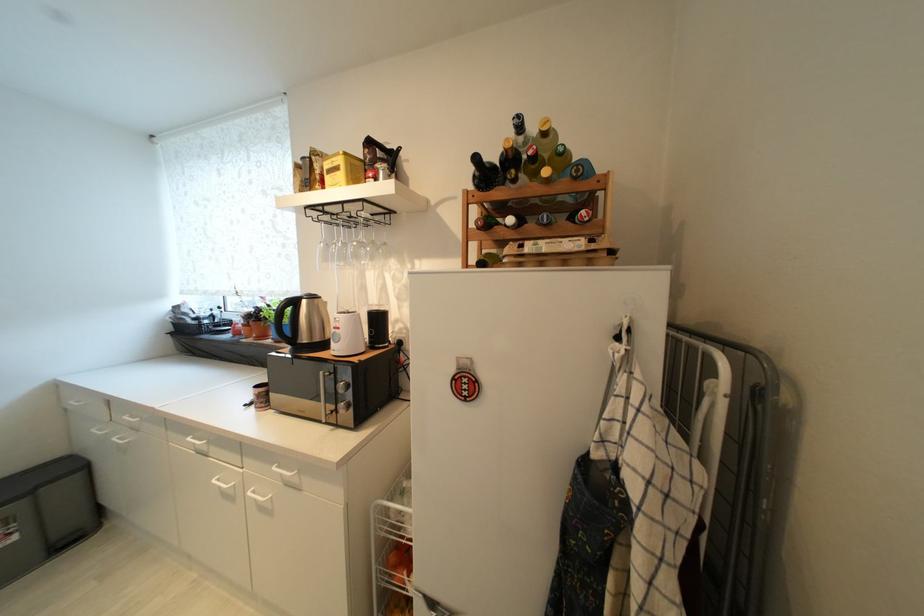
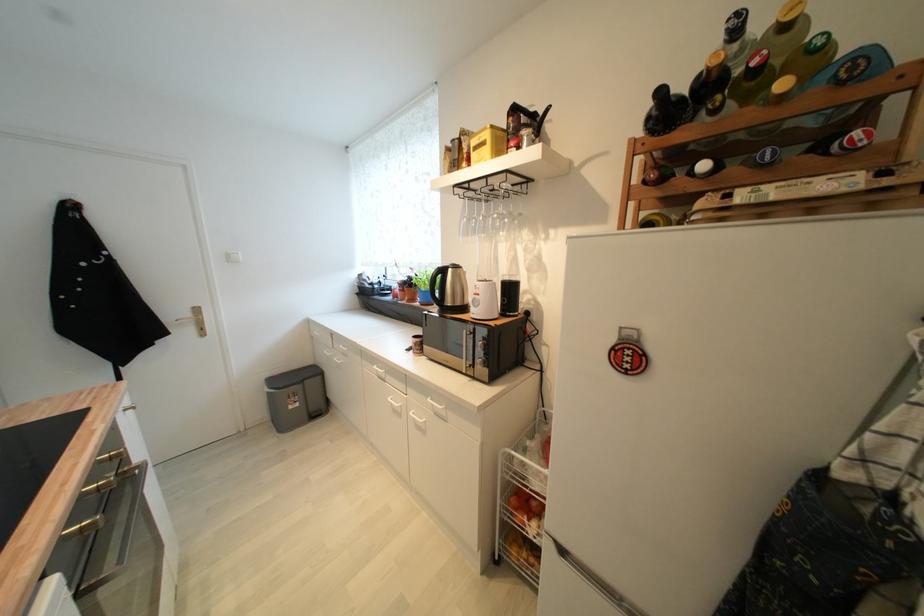
Where in the second image is the point corresponding to (195,440) from the first image?

(380, 369)